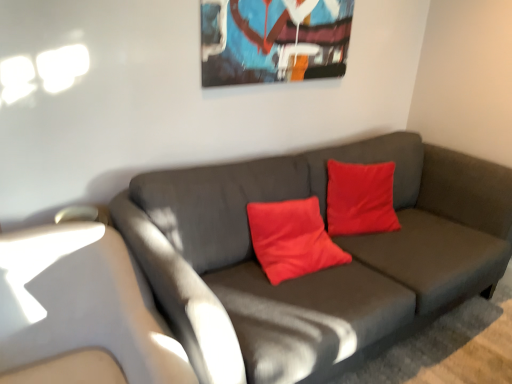
Question: Is metallic glossy picture frame at upper center situated inside matte gray couch at center or outside?

Choices:
 (A) outside
 (B) inside

Answer: (A)

Question: Visually, is metallic glossy picture frame at upper center positioned to the left or to the right of matte gray couch at center?

Choices:
 (A) left
 (B) right

Answer: (A)

Question: In terms of width, does metallic glossy picture frame at upper center look wider or thinner when compared to matte gray couch at center?

Choices:
 (A) thin
 (B) wide

Answer: (A)

Question: Based on their sizes in the image, would you say matte gray couch at center is bigger or smaller than metallic glossy picture frame at upper center?

Choices:
 (A) big
 (B) small

Answer: (A)

Question: Considering their positions, is matte gray couch at center located in front of or behind metallic glossy picture frame at upper center?

Choices:
 (A) front
 (B) behind

Answer: (A)

Question: From their relative heights in the image, would you say matte gray couch at center is taller or shorter than metallic glossy picture frame at upper center?

Choices:
 (A) tall
 (B) short

Answer: (A)

Question: Considering the positions of point (207, 258) and point (312, 26), is point (207, 258) closer or farther from the camera than point (312, 26)?

Choices:
 (A) farther
 (B) closer

Answer: (B)